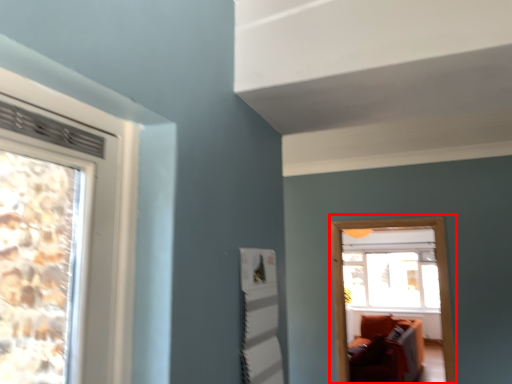
Question: From the image's perspective, what is the correct spatial positioning of window frame (annotated by the red box) in reference to window?

Choices:
 (A) above
 (B) below

Answer: (A)